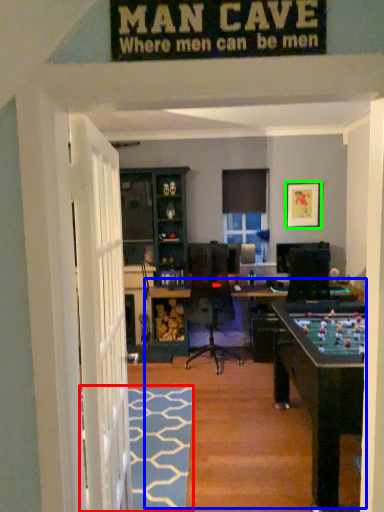
Question: Which object is positioned farthest from doormat (highlighted by a red box)? Select from table (highlighted by a blue box) and picture frame (highlighted by a green box).

Choices:
 (A) table
 (B) picture frame

Answer: (B)